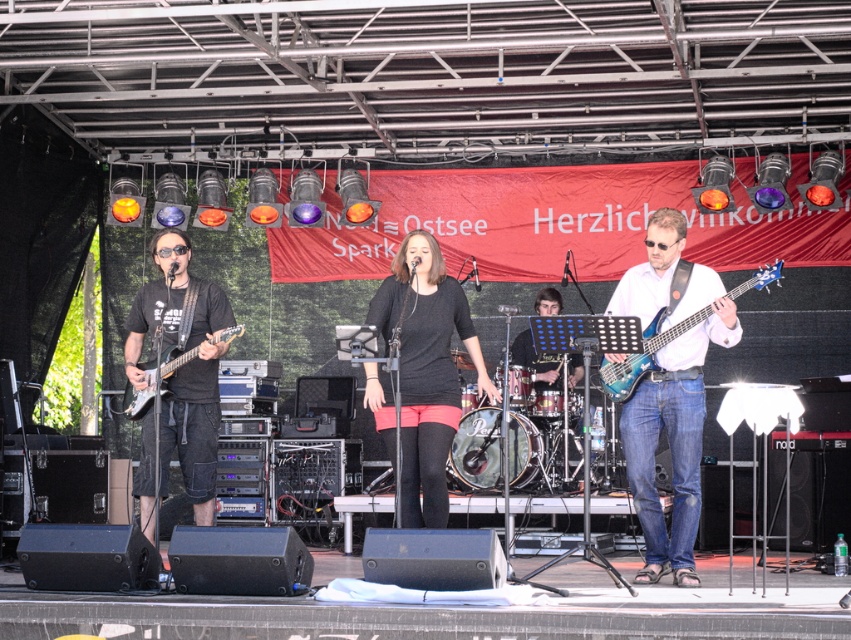
Based on the scene description, which object is positioned higher between the matte black drum set at center and the metallic drum at center?

The matte black drum set at center is positioned higher than the metallic drum at center according to the description.

You are a photographer at the live music performance. You want to take a photo of both the blue glossy bass guitar at right and the translucent blue bass at center. However, you notice that one of them is blocking the other. Which bass guitar is blocking the other one?

The translucent blue bass at center is behind the blue glossy bass guitar at right, so the blue glossy bass guitar at right is blocking the translucent blue bass at center.